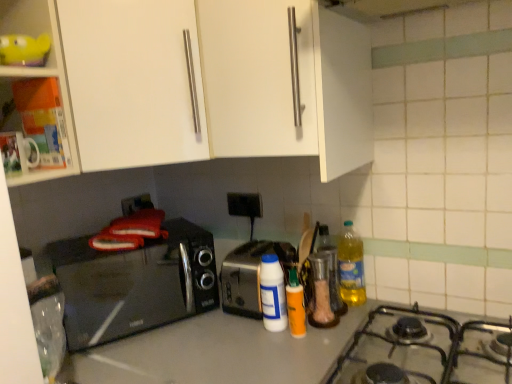
At what (x,y) coordinates should I click in order to perform the action: click on vacant area located to the right-hand side of orange matte bottle at center, the second bottle from the right. Please return your answer as a coordinate pair (x, y). Looking at the image, I should click on (335, 326).